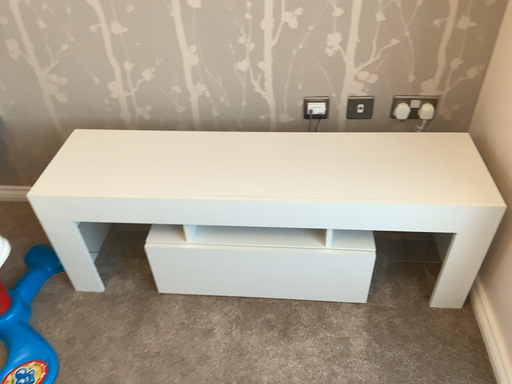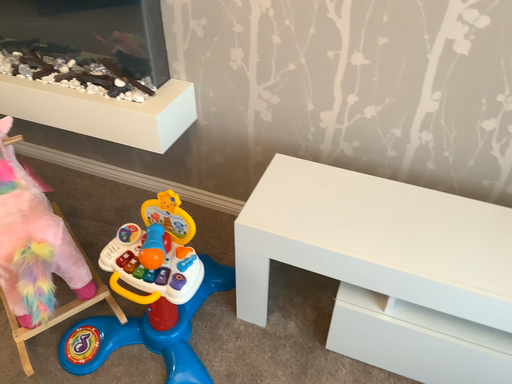
Question: How did the camera likely rotate when shooting the video?

Choices:
 (A) rotated left
 (B) rotated right

Answer: (A)